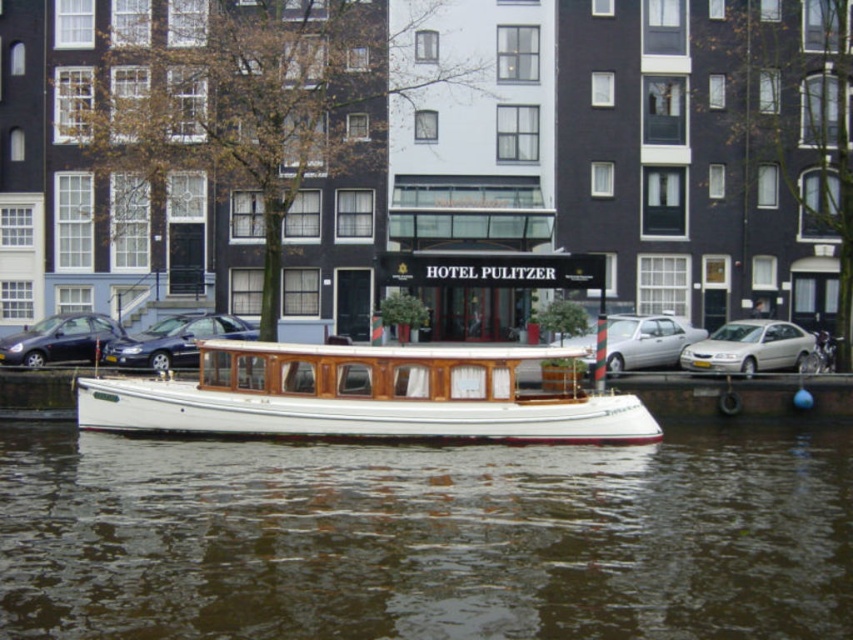
You are a tour guide leading a group along the canal. You need to explain the parking situation to your tourists. Which car is narrower between the silver metallic sedan at right and the shiny black car at center?

The silver metallic sedan at right is thinner than the shiny black car at center, so the silver metallic sedan at right is narrower.

What is the location of the point with coordinates (173,340) in the image?

The point with coordinates (173,340) is located on the shiny black car at center.

You are standing on the dock next to the canal and want to take a photo of the white wood boat at center. The camera you have can focus on objects up to 20 meters away. Will the boat be in focus?

The white wood boat at center is 22.35 meters from viewer, which is beyond the camera focus range of 20 meters. The boat will not be in focus.